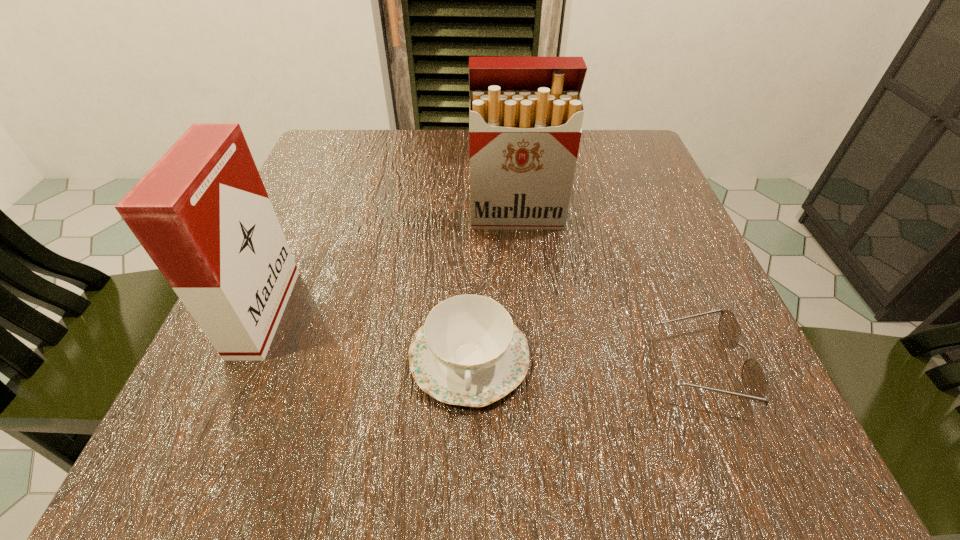
The height and width of the screenshot is (540, 960). What are the coordinates of `blank space at the right edge of the desktop` in the screenshot? It's located at (677, 285).

Image resolution: width=960 pixels, height=540 pixels. I want to click on vacant space at the far left corner of the desktop, so click(311, 153).

Where is `free space at the near left corner of the desktop`? This screenshot has width=960, height=540. free space at the near left corner of the desktop is located at coordinates (301, 430).

Find the location of `free space at the near right corner`. free space at the near right corner is located at coordinates (651, 426).

Locate an element on the screen. blank region between the third tallest object and the left cigarette_case is located at coordinates (367, 335).

The width and height of the screenshot is (960, 540). Identify the location of unoccupied area between the leftmost object and the right cigarette_case. (391, 265).

This screenshot has height=540, width=960. I want to click on vacant space in between the third tallest object and the right cigarette_case, so click(x=492, y=287).

Identify the location of vacant space that's between the nearer cigarette_case and the farthest object. (391, 265).

Find the location of `free space between the nearer cigarette_case and the third tallest object`. free space between the nearer cigarette_case and the third tallest object is located at coordinates (367, 335).

You are a GUI agent. You are given a task and a screenshot of the screen. Output one action in this format:
    pyautogui.click(x=<x>, y=<y>)
    Task: Click on the vacant point located between the leftmost object and the second shortest object
    This screenshot has height=540, width=960.
    Given the screenshot: What is the action you would take?
    pyautogui.click(x=367, y=335)